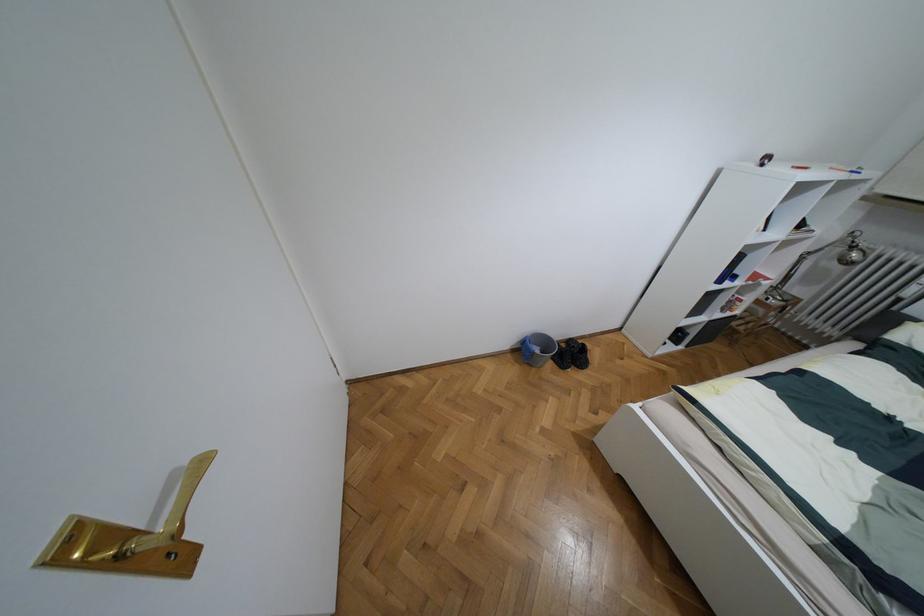
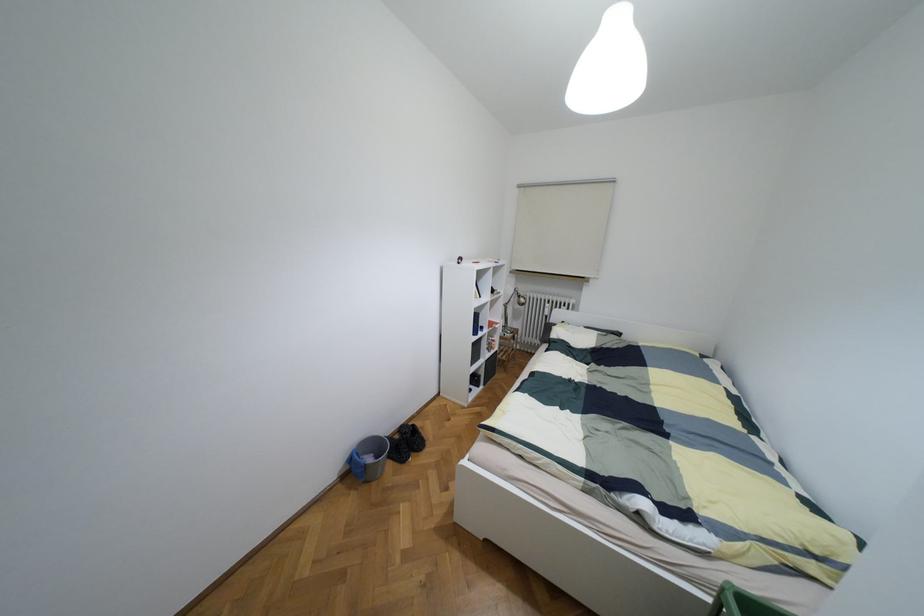
Where in the second image is the point corresponding to the point at 563,345 from the first image?

(395, 436)